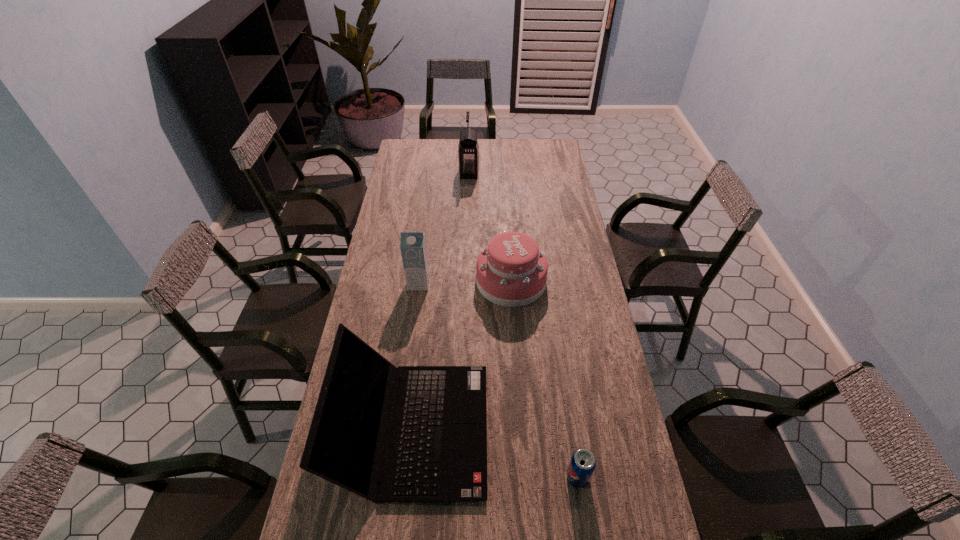
Locate an element on the screen. Image resolution: width=960 pixels, height=540 pixels. vacant point located between the carton and the shortest object is located at coordinates (498, 380).

At what (x,y) coordinates should I click in order to perform the action: click on vacant region between the tallest object and the carton. Please return your answer as a coordinate pair (x, y). Looking at the image, I should click on (444, 228).

Locate an element on the screen. This screenshot has height=540, width=960. free spot between the pop soda and the laptop computer is located at coordinates (496, 453).

Image resolution: width=960 pixels, height=540 pixels. What are the coordinates of `vacant area that lies between the cake and the carton` in the screenshot? It's located at (465, 282).

The height and width of the screenshot is (540, 960). I want to click on free spot between the cake and the pop soda, so click(544, 379).

I want to click on vacant area that lies between the laptop computer and the shortest object, so click(x=496, y=453).

Identify the location of vacant space that's between the farthest object and the laptop computer. This screenshot has width=960, height=540. (442, 301).

Find the location of a particular element. free point between the laptop computer and the shortest object is located at coordinates (496, 453).

Identify which object is the second closest to the carton. Please provide its 2D coordinates. Your answer should be formatted as a tuple, i.e. [(x, y)], where the tuple contains the x and y coordinates of a point satisfying the conditions above.

[(438, 453)]

Point out which object is positioned as the third nearest to the cake. Please provide its 2D coordinates. Your answer should be formatted as a tuple, i.e. [(x, y)], where the tuple contains the x and y coordinates of a point satisfying the conditions above.

[(468, 148)]